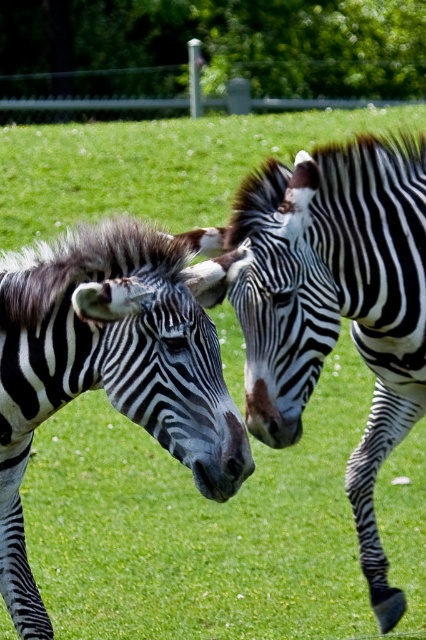
Could you measure the distance between black and white striped zebra at center and black and white striped zebra at left?

The distance of black and white striped zebra at center from black and white striped zebra at left is 78.32 centimeters.

Does black and white striped zebra at center appear under black and white striped zebra at left?

Actually, black and white striped zebra at center is above black and white striped zebra at left.

Which is in front, point (253, 432) or point (17, 428)?

Positioned in front is point (17, 428).

The image size is (426, 640). In order to click on black and white striped zebra at center in this screenshot , I will do `click(334, 301)`.